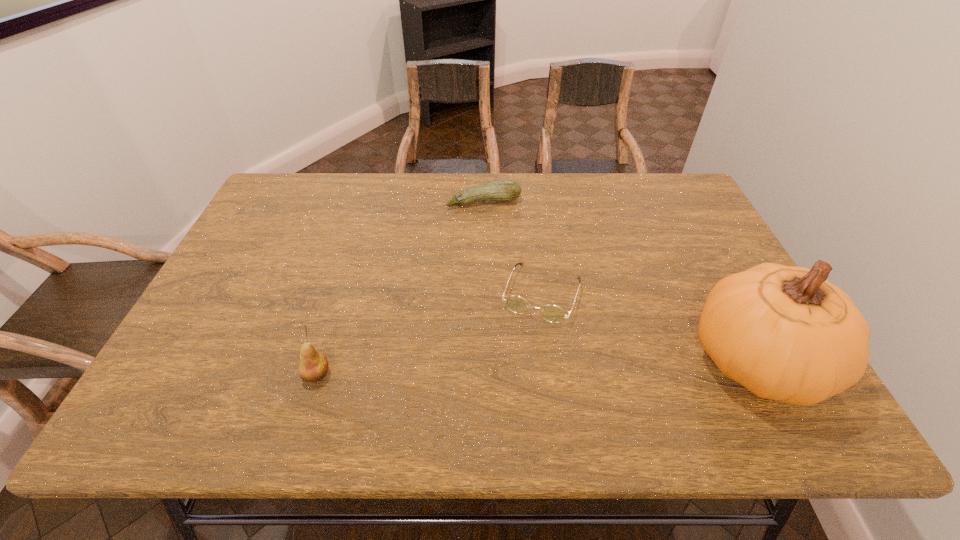
In order to click on vacant space in between the zucchini and the spectacles in this screenshot , I will do `click(513, 247)`.

At what (x,y) coordinates should I click in order to perform the action: click on unoccupied area between the zucchini and the spectacles. Please return your answer as a coordinate pair (x, y). Looking at the image, I should click on (513, 247).

The image size is (960, 540). I want to click on vacant area that lies between the zucchini and the rightmost object, so click(619, 282).

Identify the location of the second closest object relative to the leftmost object. (499, 190).

The image size is (960, 540). In order to click on object that is the third nearest to the shortest object in this screenshot , I will do `click(313, 366)`.

Image resolution: width=960 pixels, height=540 pixels. What are the coordinates of `free space that satisfies the following two spatial constraints: 1. on the front side of the pumpkin; 2. on the front face of the spectacles` in the screenshot? It's located at (550, 362).

Where is `free space that satisfies the following two spatial constraints: 1. on the back side of the pear; 2. on the front face of the tallest object`? The width and height of the screenshot is (960, 540). free space that satisfies the following two spatial constraints: 1. on the back side of the pear; 2. on the front face of the tallest object is located at coordinates (321, 362).

The width and height of the screenshot is (960, 540). I want to click on vacant region that satisfies the following two spatial constraints: 1. on the back side of the zucchini; 2. on the right side of the leftmost object, so click(x=370, y=201).